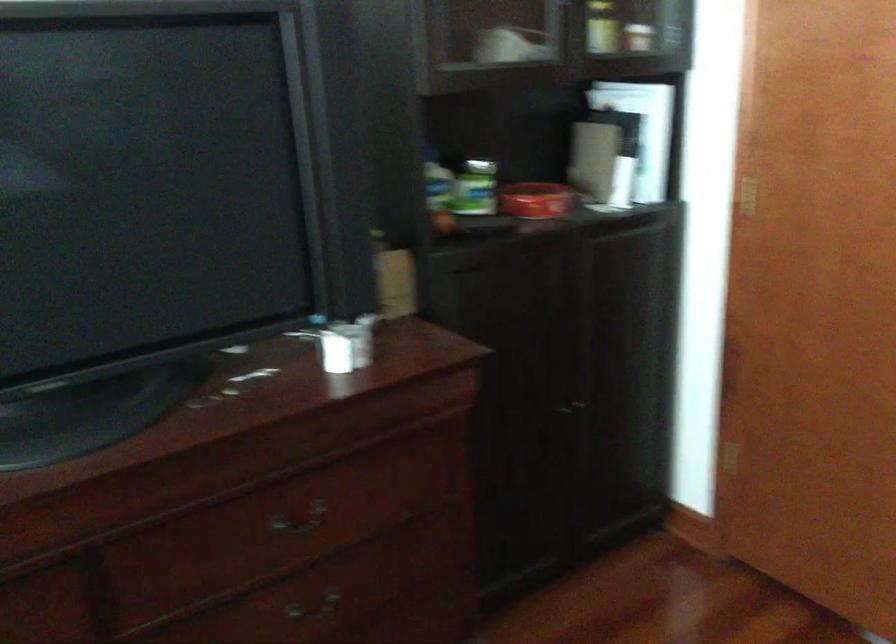
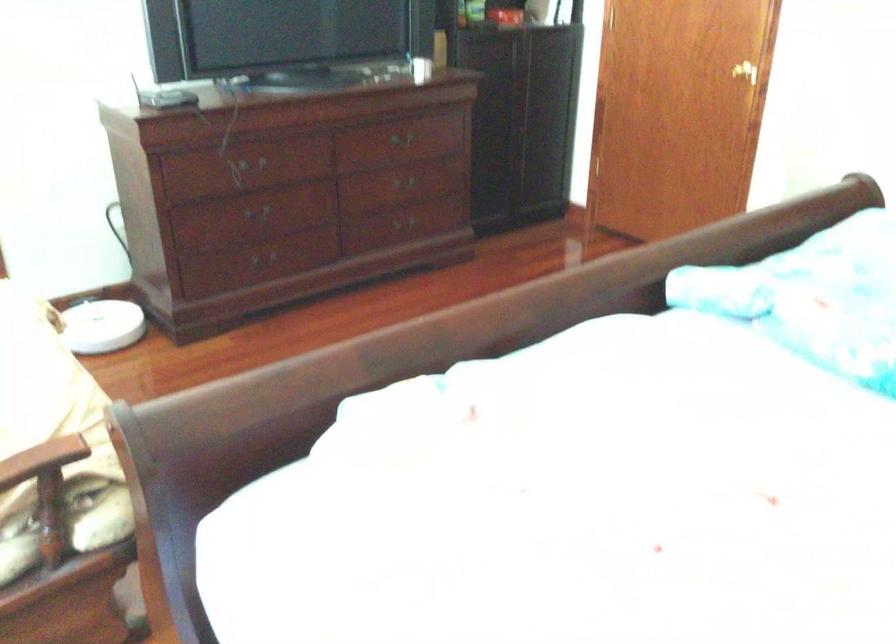
Where in the second image is the point corresponding to point 317,514 from the first image?

(401, 138)